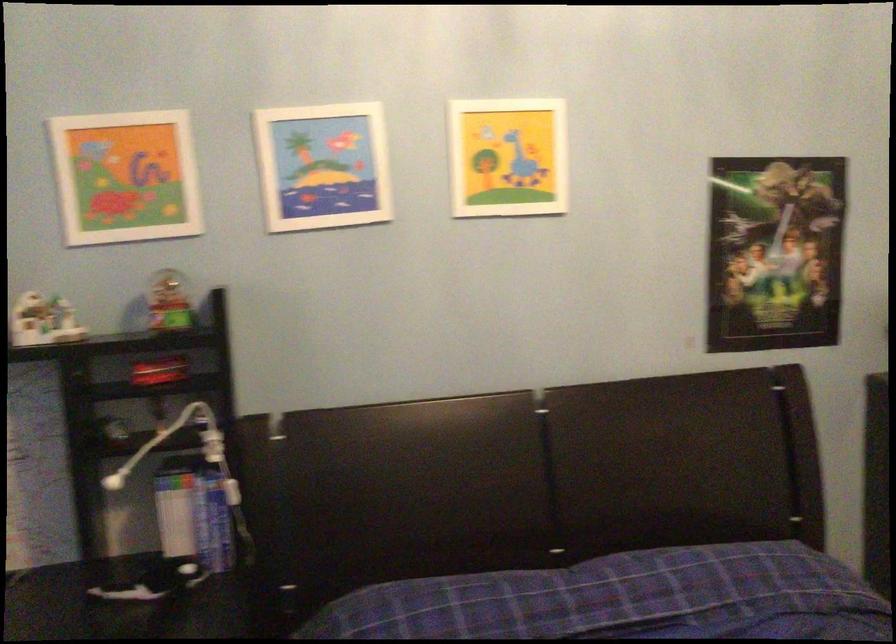
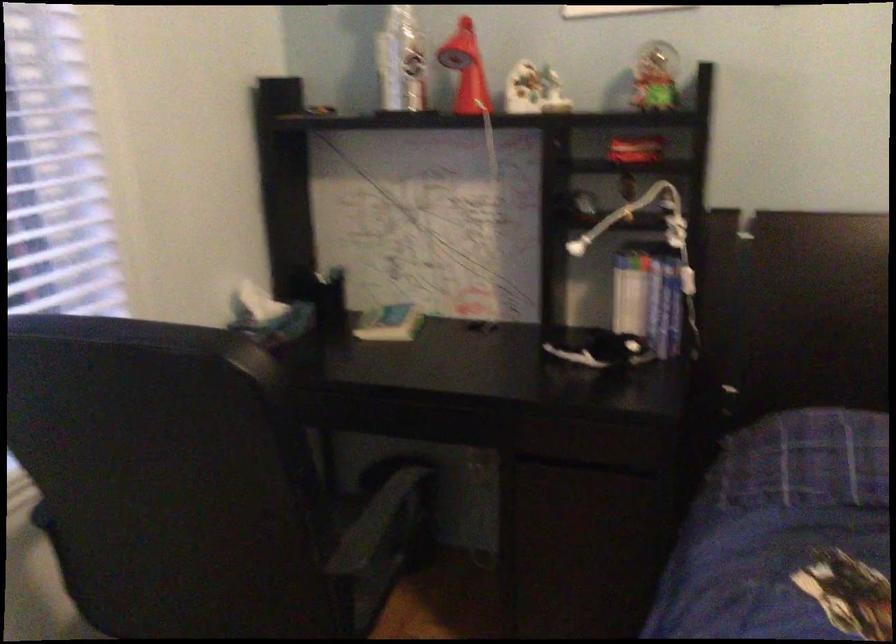
Where in the second image is the point corresponding to the point at 176,522 from the first image?

(629, 301)